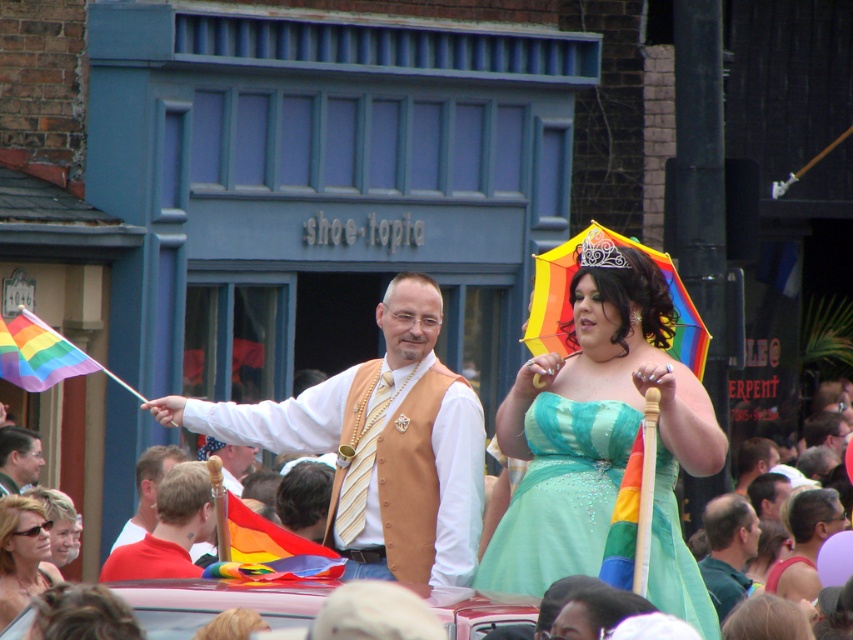
Question: Which object is the closest to the smooth skin head at center?

Choices:
 (A) white fabric shirt at center
 (B) matte black sunglasses at lower left

Answer: (A)

Question: Is matte gold vest at center bigger than rainbow fabric flag at center?

Choices:
 (A) yes
 (B) no

Answer: (B)

Question: Among these objects, which one is farthest from the camera?

Choices:
 (A) rainbow fabric flag at center
 (B) shiny green dress at center
 (C) rainbow fabric flag at left
 (D) smooth white shirt at center

Answer: (D)

Question: Does rainbow fabric umbrella at upper right have a larger size compared to rainbow fabric flag at center?

Choices:
 (A) yes
 (B) no

Answer: (A)

Question: Which point is farther to the camera?

Choices:
 (A) pyautogui.click(x=392, y=371)
 (B) pyautogui.click(x=10, y=349)
 (C) pyautogui.click(x=160, y=492)

Answer: (C)

Question: Can you confirm if matte gold vest at center is positioned to the right of rainbow fabric flag at left?

Choices:
 (A) yes
 (B) no

Answer: (A)